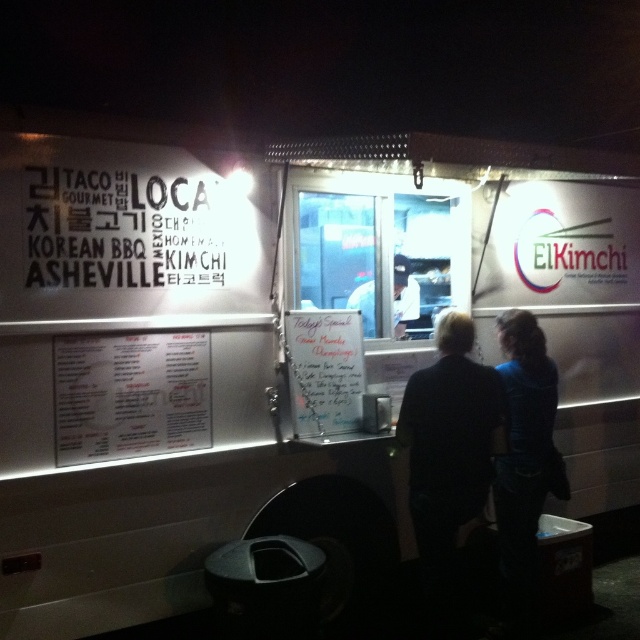
Question: Which of the following is the closest to the observer?

Choices:
 (A) dark fabric shirt at center
 (B) white fabric shirt at center
 (C) white paper menu at center

Answer: (C)

Question: Can you confirm if dark fabric shirt at center is wider than white paper menu at center?

Choices:
 (A) yes
 (B) no

Answer: (B)

Question: Does white paper menu at center lie in front of whiteboard menu at center?

Choices:
 (A) no
 (B) yes

Answer: (B)

Question: Which point is closer to the camera?

Choices:
 (A) (445, 404)
 (B) (106, 337)

Answer: (B)

Question: Among these objects, which one is farthest from the camera?

Choices:
 (A) dark fabric shirt at center
 (B) white fabric shirt at center
 (C) whiteboard menu at center

Answer: (B)

Question: Is dark fabric shirt at center bigger than white paper menu at center?

Choices:
 (A) no
 (B) yes

Answer: (B)